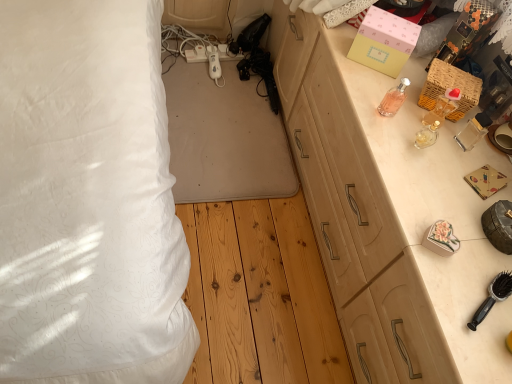
Identify the location of unoccupied area in front of black plastic brush at lower right. (474, 349).